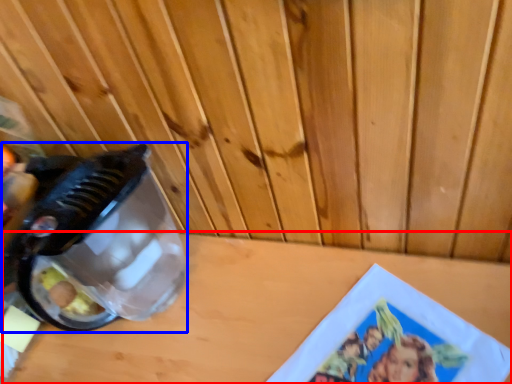
Question: Which of the following is the farthest to the observer, table top (highlighted by a red box) or appliance (highlighted by a blue box)?

Choices:
 (A) table top
 (B) appliance

Answer: (B)